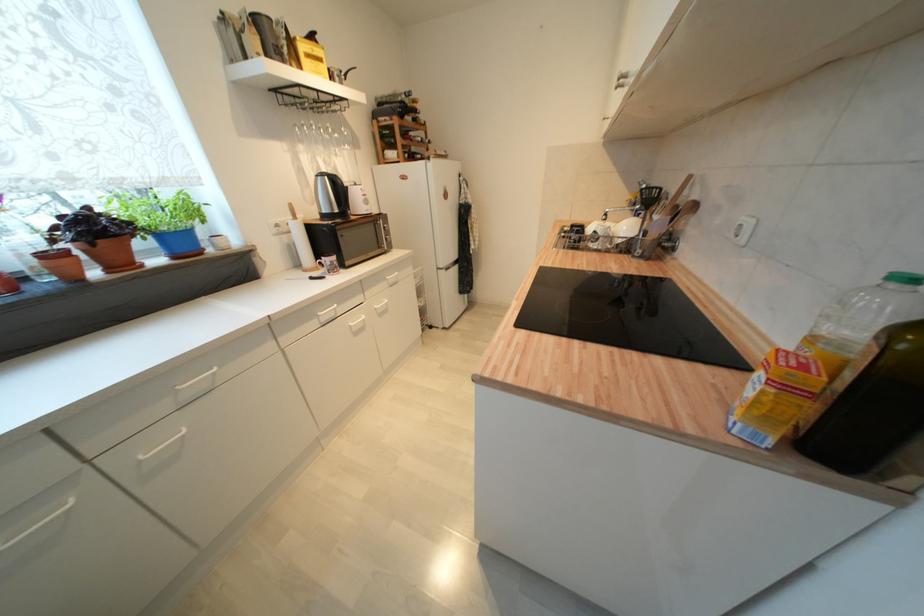
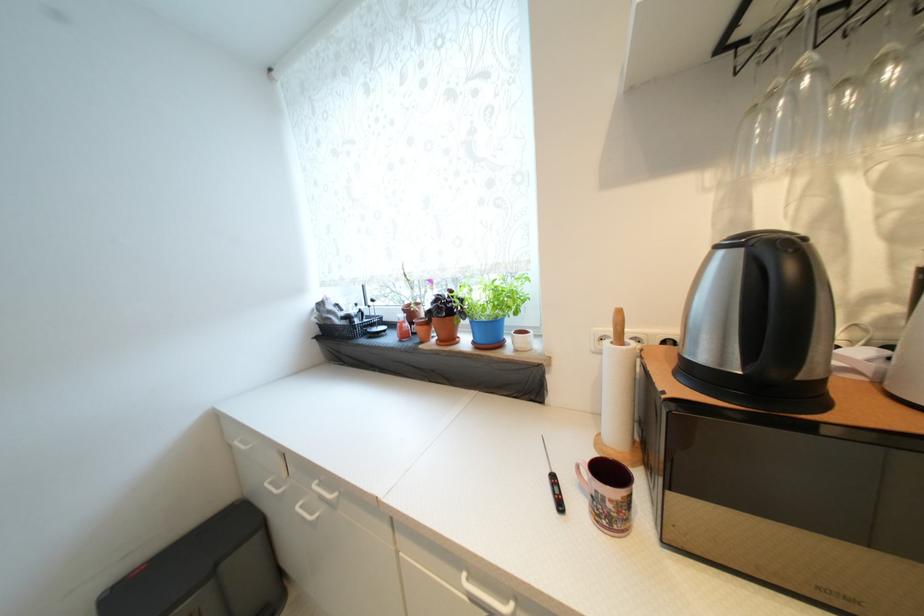
Where in the second image is the point corresponding to point (116, 272) from the first image?

(445, 342)